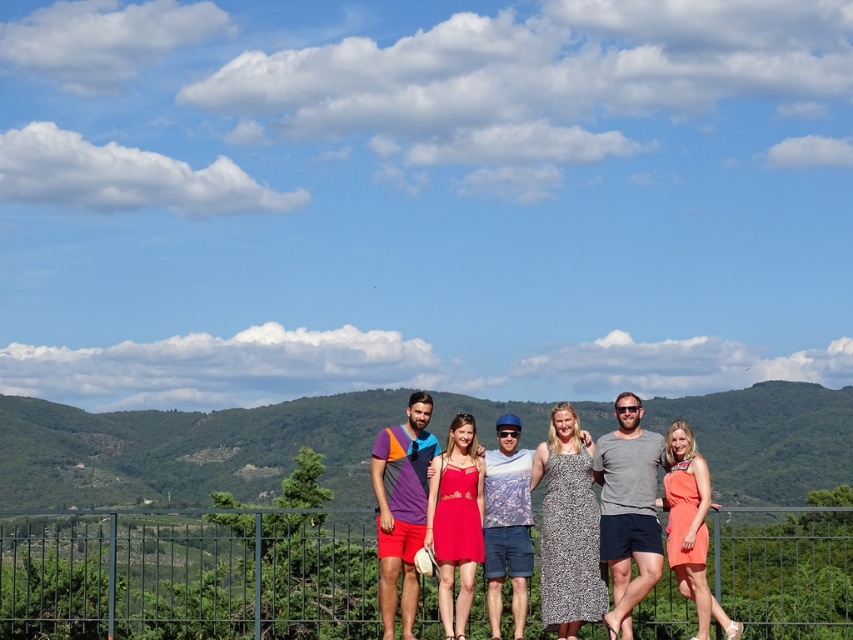
You are a photographer trying to capture a photo of the group. You notice the multicolored jersey at center and the blue denim shorts at center. Which clothing item is located to the left of the other?

The multicolored jersey at center is positioned on the left side of blue denim shorts at center.

You are a photographer trying to capture the group of people in the scene. You want to focus on the multicolored jersey at center. Where should you aim your camera to ensure the jersey is in the center of your shot?

You should aim your camera at the coordinates point (401,508) where the multicolored jersey at center is located to ensure it is centered in your shot.